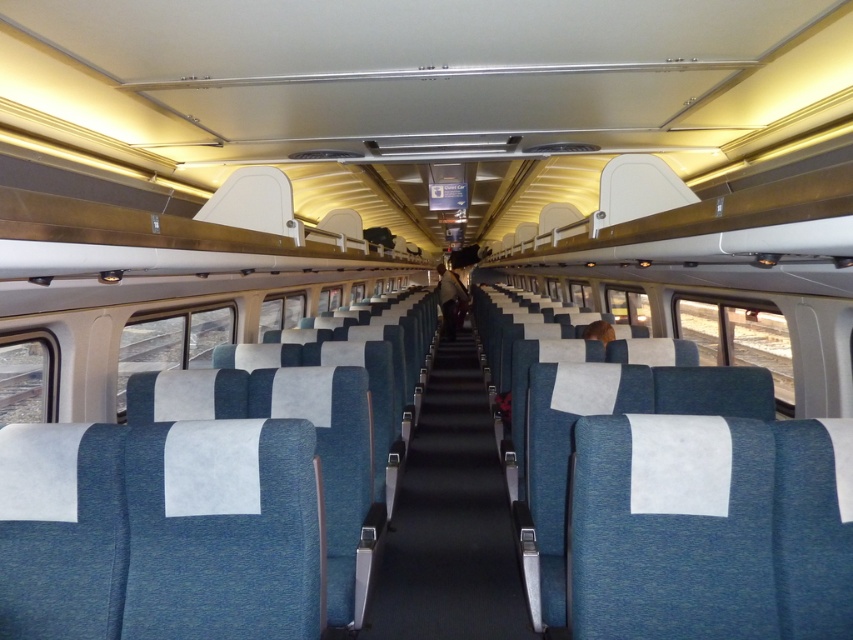
Does blue fabric aisle at center have a smaller size compared to blue fabric coach at center?

Incorrect, blue fabric aisle at center is not smaller in size than blue fabric coach at center.

This screenshot has height=640, width=853. In order to click on blue fabric aisle at center in this screenshot , I will do `click(450, 520)`.

Locate an element on the screen. This screenshot has width=853, height=640. blue fabric aisle at center is located at coordinates (450, 520).